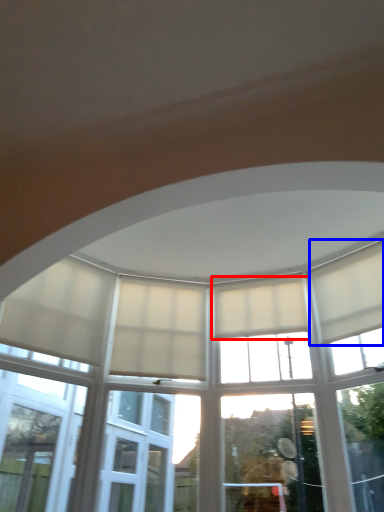
Question: Which object appears closest to the camera in this image, curtain (highlighted by a red box) or curtain (highlighted by a blue box)?

Choices:
 (A) curtain
 (B) curtain

Answer: (B)